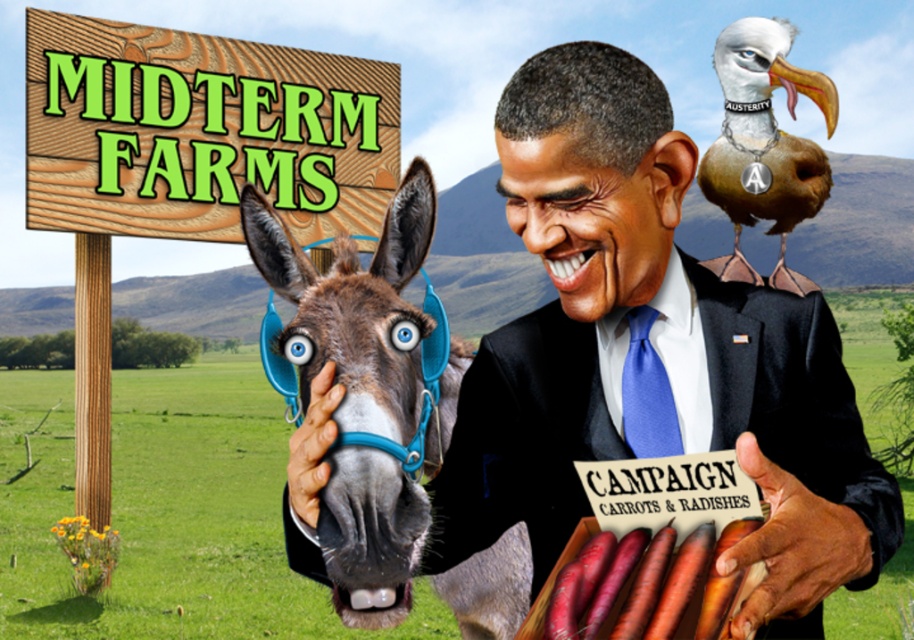
You are a photographer trying to capture the entire scene of MIDTERM FARMS in one shot. However, you notice that the brown feathered bird at upper right and the wooden signboard at upper left are overlapping. Which object should you adjust your camera angle to focus on so that the other object becomes visible without obstruction?

The brown feathered bird at upper right is behind the wooden signboard at upper left. To make the bird visible without obstruction, adjust the camera angle to focus on the wooden signboard at upper left, which is in front, allowing the bird to come into view. Alternatively, focusing on the bird would require moving the signboard, which isn

You are a photographer trying to capture a photo of the brown leather donkey at left and the black satin business suit at center. Which object should you focus on first if you want to ensure both are in sharp focus, considering their relative heights?

The black satin business suit at center has a lesser height compared to the brown leather donkey at left. To ensure both are in sharp focus, you should focus on the brown leather donkey at left first since it is taller, allowing the shorter object to fall within the depth of field range.

You are an artist analyzing the digital collage. You notice the wooden signboard at upper left and the brown feathered bird at upper right. Which object takes up more space in the image?

The brown feathered bird at upper right takes up more space in the image because it is larger than the wooden signboard at upper left.